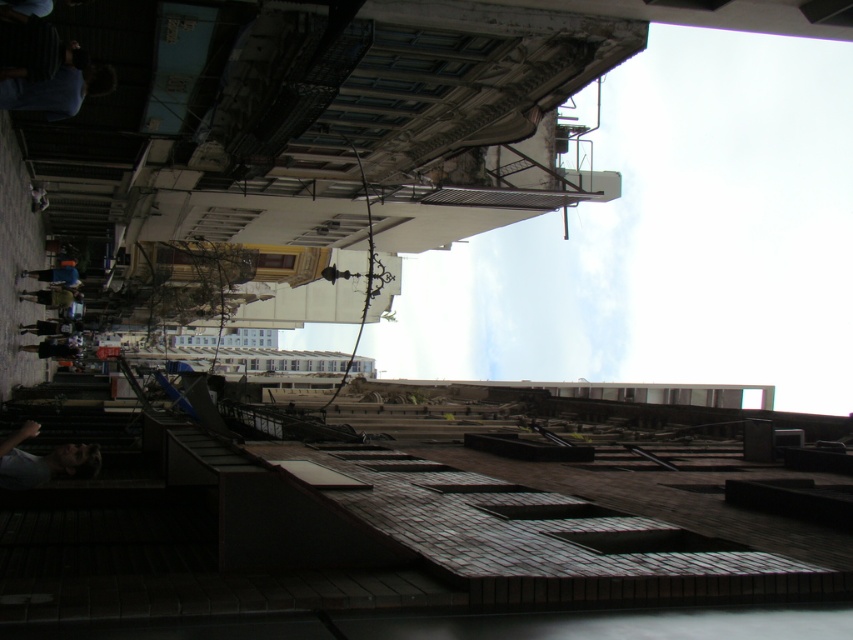
Question: Which point is closer to the camera?

Choices:
 (A) light brown leather jacket at left
 (B) light blue fabric at lower left

Answer: (B)

Question: Can you confirm if light blue fabric at lower left is wider than light brown leather jacket at left?

Choices:
 (A) no
 (B) yes

Answer: (A)

Question: Which is farther from the blue denim jacket at left?

Choices:
 (A) light blue fabric at lower left
 (B) light brown leather jacket at left

Answer: (A)

Question: Does light blue fabric at lower left appear under blue denim jacket at left?

Choices:
 (A) yes
 (B) no

Answer: (A)

Question: Among these points, which one is nearest to the camera?

Choices:
 (A) (49, 298)
 (B) (35, 428)

Answer: (B)

Question: Observing the image, what is the correct spatial positioning of light blue fabric at lower left in reference to light brown leather jacket at left?

Choices:
 (A) right
 (B) left

Answer: (A)